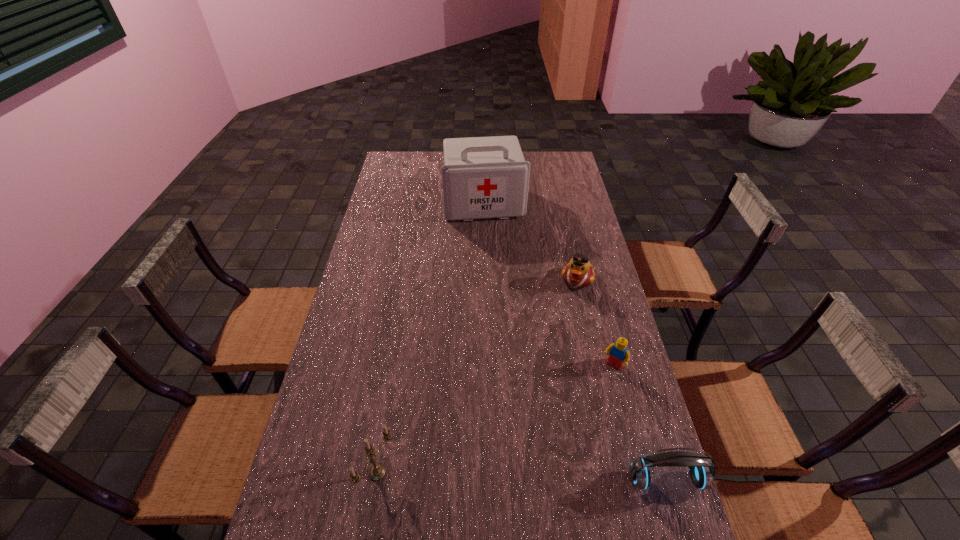
At what (x,y) coordinates should I click in order to perform the action: click on Lego at the right edge. Please return your answer as a coordinate pair (x, y). The width and height of the screenshot is (960, 540). Looking at the image, I should click on (618, 353).

You are a GUI agent. You are given a task and a screenshot of the screen. Output one action in this format:
    pyautogui.click(x=<x>, y=<y>)
    Task: Click on the duck at the right edge
    This screenshot has width=960, height=540.
    Given the screenshot: What is the action you would take?
    (x=578, y=273)

In the image, there is a desktop. At what (x,y) coordinates should I click in order to perform the action: click on vacant space at the left edge. Please return your answer as a coordinate pair (x, y). This screenshot has height=540, width=960. Looking at the image, I should click on (417, 179).

The width and height of the screenshot is (960, 540). I want to click on vacant area at the right edge, so click(x=604, y=474).

Find the location of a particular element. vacant space at the far left corner of the desktop is located at coordinates (413, 157).

Where is `vacant space at the far right corner of the desktop`? The width and height of the screenshot is (960, 540). vacant space at the far right corner of the desktop is located at coordinates (556, 157).

This screenshot has height=540, width=960. Identify the location of vacant space at the near right corner of the desktop. (636, 521).

The image size is (960, 540). I want to click on vacant region between the farthest object and the Lego, so click(x=548, y=285).

Identify the location of empty space between the headset and the fourth nearest object. The width and height of the screenshot is (960, 540). (622, 380).

The width and height of the screenshot is (960, 540). Find the location of `empty space between the headset and the third farthest object`. empty space between the headset and the third farthest object is located at coordinates (639, 423).